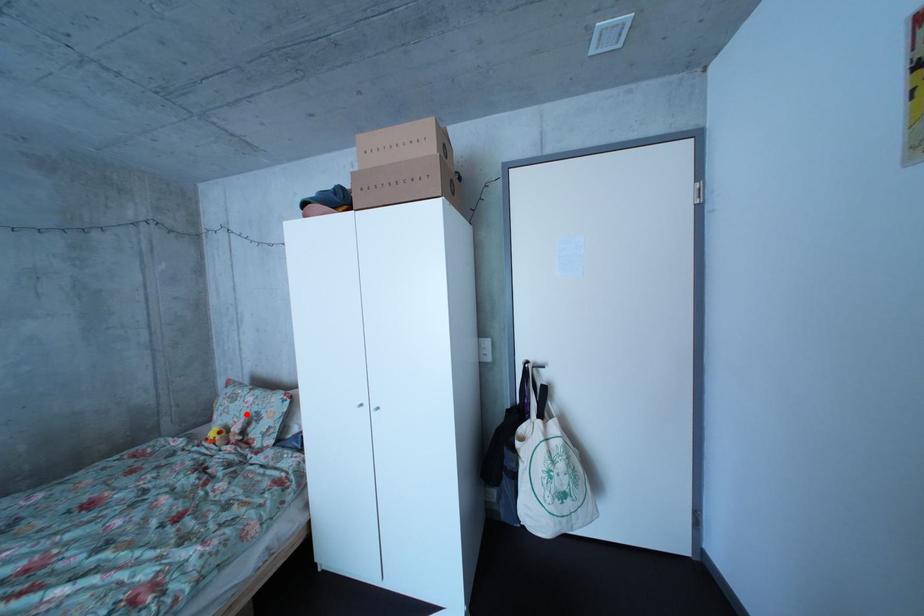
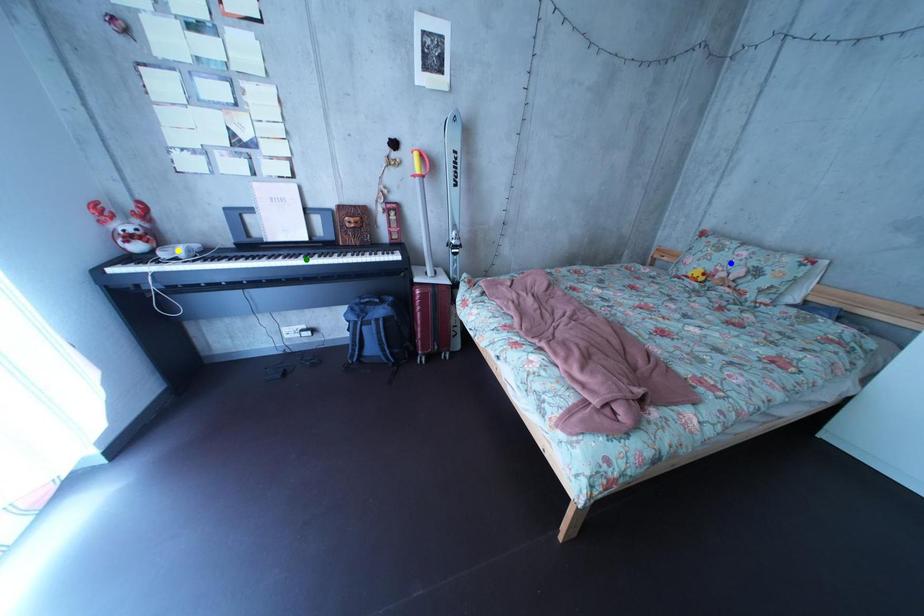
Question: I am providing you with two images of the same scene from different viewpoints. A red point is marked on the first image. You are given multiple points on the second image. Which point in image 2 represents the same 3d spot as the red point in image 1?

Choices:
 (A) blue point
 (B) green point
 (C) yellow point

Answer: (A)